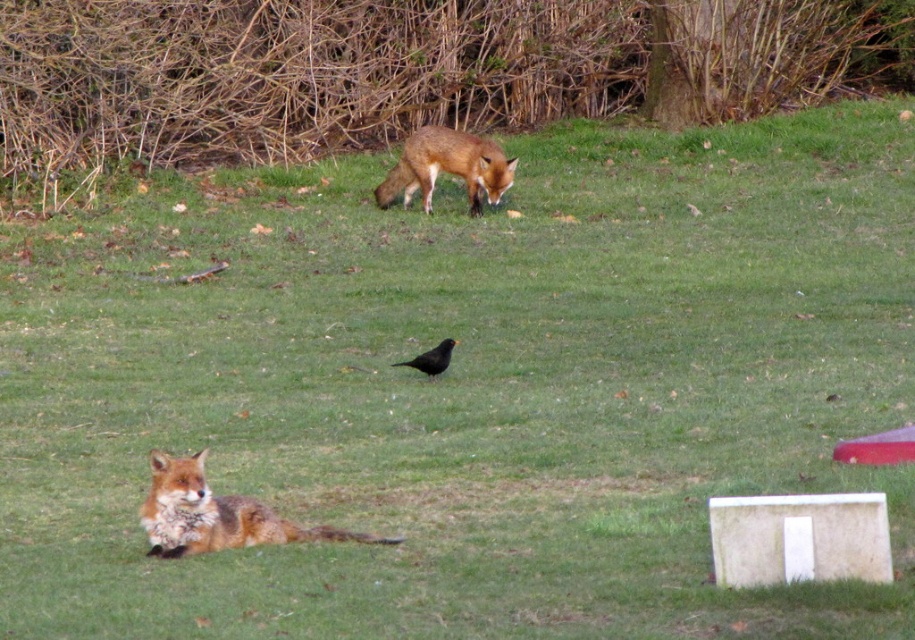
You are a photographer trying to capture both the orange fur fox at lower left and the orange fur fox at upper center in a single shot. Which fox will appear smaller in the photo?

The orange fur fox at lower left will appear smaller in the photo because its actual width is less than the orange fur fox at upper center.

You are a photographer trying to capture a closeup shot of the orange fur fox at upper center and the black matte bird at center. Since you want both subjects to be in focus, you need to adjust your camera settings. Which subject should you focus on to ensure both are sharp?

You should focus on the orange fur fox at upper center because it is larger in size than the black matte bird at center, so focusing on the larger subject will help keep both in focus.